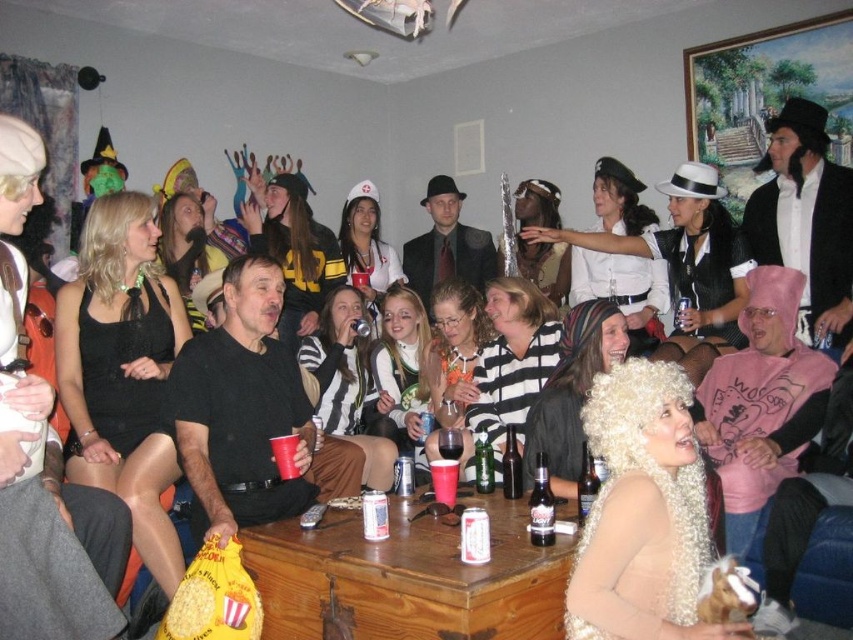
Question: Is black satin dress at center bigger than matte black suit at center?

Choices:
 (A) yes
 (B) no

Answer: (B)

Question: Which point appears closest to the camera in this image?

Choices:
 (A) (552, 518)
 (B) (593, 464)
 (C) (138, 465)
 (D) (167, 342)

Answer: (A)

Question: Does black velvet hat at upper right have a smaller size compared to matte black suit at center?

Choices:
 (A) yes
 (B) no

Answer: (B)

Question: Is black satin dress at center thinner than matte black suit at center?

Choices:
 (A) yes
 (B) no

Answer: (A)

Question: Which point is farther to the camera?

Choices:
 (A) (142, 332)
 (B) (816, 252)
 (C) (292, 442)
 (D) (125, 253)

Answer: (B)

Question: Estimate the real-world distances between objects in this image. Which object is closer to the brown glass beer bottle at center?

Choices:
 (A) dark brown glass bottle at center
 (B) black satin dress at center
 (C) translucent plastic cup at center

Answer: (A)